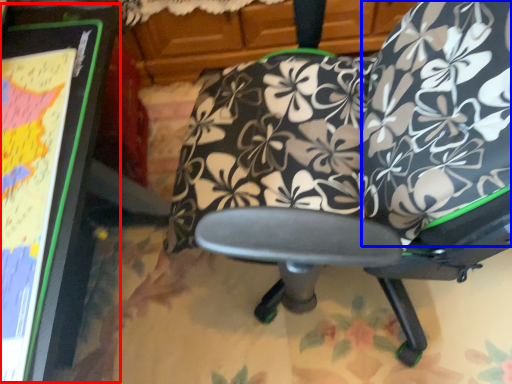
Question: Which point is closer to the camera, bulletin board (highlighted by a red box) or bean bag chair (highlighted by a blue box)?

Choices:
 (A) bulletin board
 (B) bean bag chair

Answer: (A)